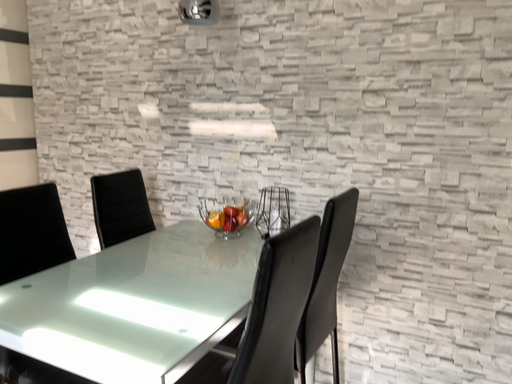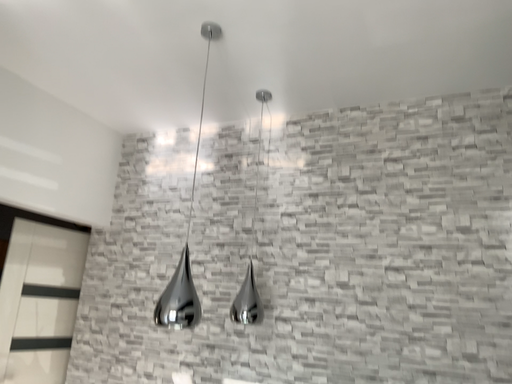
Question: How did the camera likely rotate when shooting the video?

Choices:
 (A) rotated downward
 (B) rotated upward

Answer: (B)